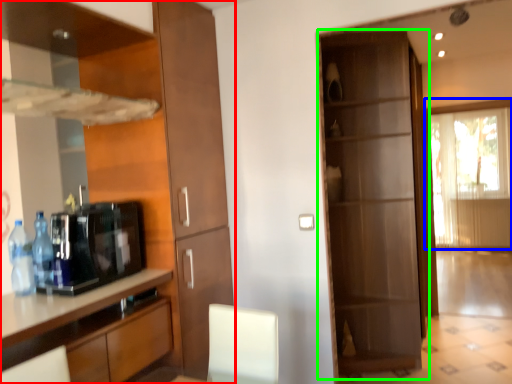
Question: Considering the real-world distances, which object is farthest from cabinetry (highlighted by a red box)? window (highlighted by a blue box) or door (highlighted by a green box)?

Choices:
 (A) window
 (B) door

Answer: (A)